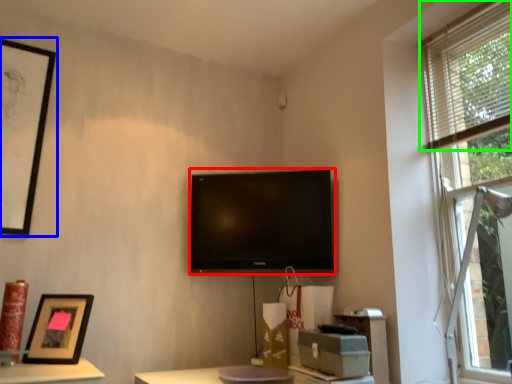
Question: Estimate the real-world distances between objects in this image. Which object is closer to television (highlighted by a red box), picture frame (highlighted by a blue box) or blind (highlighted by a green box)?

Choices:
 (A) picture frame
 (B) blind

Answer: (B)